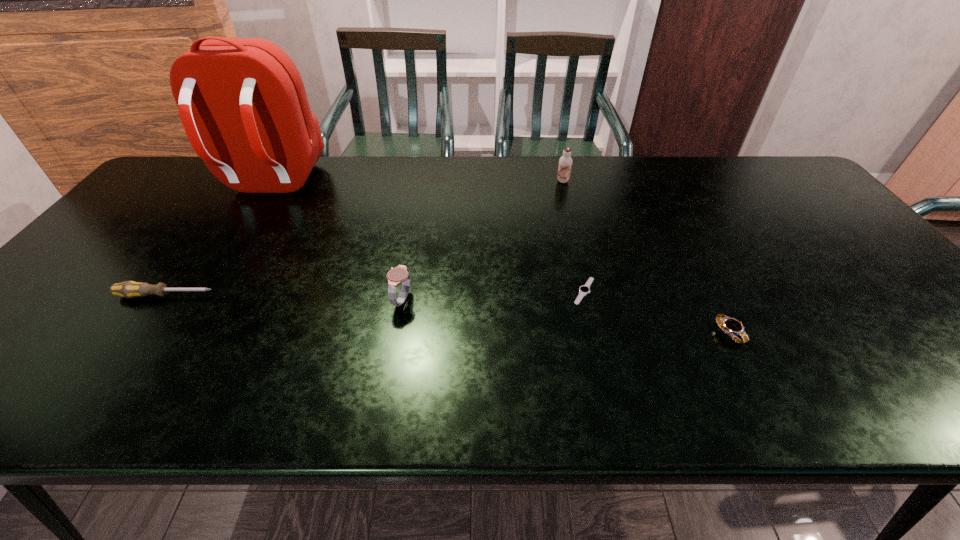
You are a GUI agent. You are given a task and a screenshot of the screen. Output one action in this format:
    pyautogui.click(x=<x>, y=<y>)
    Task: Click on the vacant point located on the front of the fifth shortest object
    This screenshot has width=960, height=540.
    Given the screenshot: What is the action you would take?
    pyautogui.click(x=571, y=217)

Locate an element on the screen. Image resolution: width=960 pixels, height=540 pixels. vacant space located 0.230m on the back of the third tallest object is located at coordinates (414, 228).

Where is `vacant region located at the tip of the screwdriver`? The height and width of the screenshot is (540, 960). vacant region located at the tip of the screwdriver is located at coordinates click(x=383, y=295).

At what (x,y) coordinates should I click in order to perform the action: click on free space located 0.300m on the back of the rightmost watch. Please return your answer as a coordinate pair (x, y). The width and height of the screenshot is (960, 540). Looking at the image, I should click on (679, 237).

Find the location of `vacant space located 0.050m on the back of the second watch from left to right`. vacant space located 0.050m on the back of the second watch from left to right is located at coordinates (578, 264).

This screenshot has height=540, width=960. What are the coordinates of `backpack located at the far edge` in the screenshot? It's located at (242, 102).

At what (x,y) coordinates should I click in order to perform the action: click on chocolate milk situated at the far edge. Please return your answer as a coordinate pair (x, y). The width and height of the screenshot is (960, 540). Looking at the image, I should click on (565, 162).

Locate an element on the screen. The image size is (960, 540). object that is at the left edge is located at coordinates tap(129, 289).

I want to click on free location at the far edge of the desktop, so click(374, 157).

The height and width of the screenshot is (540, 960). What are the coordinates of `free space at the near edge of the desktop` in the screenshot? It's located at (782, 382).